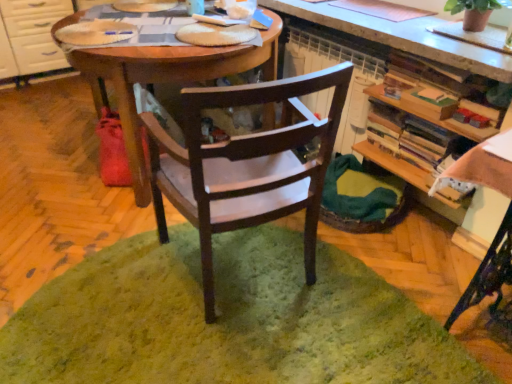
Question: Could you tell me if wooden bookshelf at right is turned towards mahogany wood chair at center?

Choices:
 (A) no
 (B) yes

Answer: (B)

Question: Does wooden bookshelf at right have a lesser height compared to mahogany wood chair at center?

Choices:
 (A) yes
 (B) no

Answer: (A)

Question: Is wooden bookshelf at right wider than mahogany wood chair at center?

Choices:
 (A) no
 (B) yes

Answer: (A)

Question: Is wooden bookshelf at right at the left side of mahogany wood chair at center?

Choices:
 (A) yes
 (B) no

Answer: (B)

Question: Is wooden bookshelf at right not close to mahogany wood chair at center?

Choices:
 (A) yes
 (B) no

Answer: (B)

Question: Can mahogany wood chair at center be found inside wooden bookshelf at right?

Choices:
 (A) no
 (B) yes

Answer: (A)

Question: Considering the relative sizes of green matte plant at upper right and green fuzzy rug at center in the image provided, is green matte plant at upper right shorter than green fuzzy rug at center?

Choices:
 (A) yes
 (B) no

Answer: (B)

Question: Is green matte plant at upper right positioned behind green fuzzy rug at center?

Choices:
 (A) no
 (B) yes

Answer: (B)

Question: Is green fuzzy rug at center inside green matte plant at upper right?

Choices:
 (A) yes
 (B) no

Answer: (B)

Question: Does green matte plant at upper right have a greater height compared to green fuzzy rug at center?

Choices:
 (A) yes
 (B) no

Answer: (A)

Question: Is green matte plant at upper right turned away from green fuzzy rug at center?

Choices:
 (A) no
 (B) yes

Answer: (A)

Question: Is green matte plant at upper right at the left side of green fuzzy rug at center?

Choices:
 (A) no
 (B) yes

Answer: (A)

Question: Considering the relative positions of wooden desk at center and white glossy cabinet at left in the image provided, is wooden desk at center in front of white glossy cabinet at left?

Choices:
 (A) no
 (B) yes

Answer: (B)